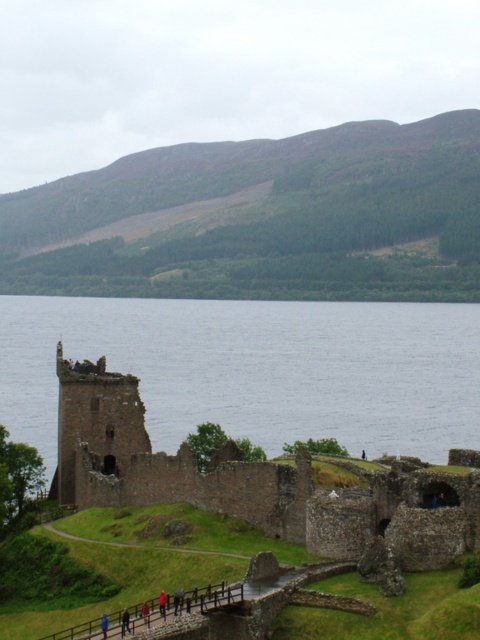
Question: Does dark blue fabric jacket at lower center have a lesser width compared to red fabric jacket at center?

Choices:
 (A) yes
 (B) no

Answer: (A)

Question: Among these points, which one is nearest to the camera?

Choices:
 (A) (107, 621)
 (B) (121, 632)

Answer: (B)

Question: Is brown stone castle at left above blue fabric person at lower center?

Choices:
 (A) yes
 (B) no

Answer: (A)

Question: Based on their relative distances, which object is farther from the brown stone castle at left?

Choices:
 (A) blue fabric person at lower center
 (B) red fabric jacket at center
 (C) dark blue fabric jacket at lower center

Answer: (C)

Question: Can you confirm if brown stone castle at left is positioned to the left of red fabric jacket at center?

Choices:
 (A) yes
 (B) no

Answer: (B)

Question: Which point appears closest to the camera in this image?

Choices:
 (A) (164, 616)
 (B) (404, 513)

Answer: (A)